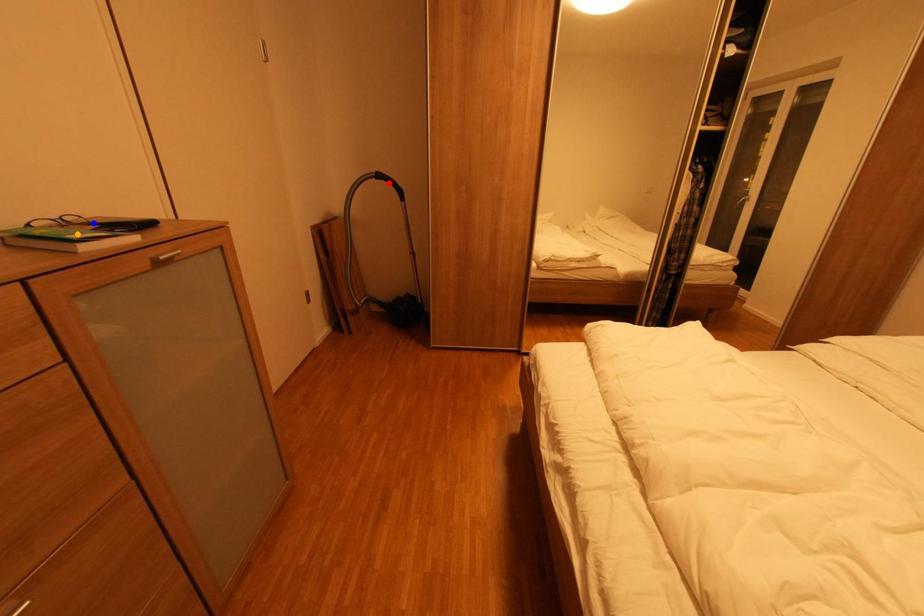
Order these from nearest to farthest:
blue point | red point | orange point

orange point → blue point → red point